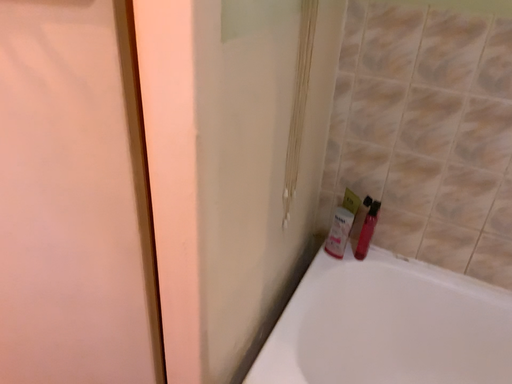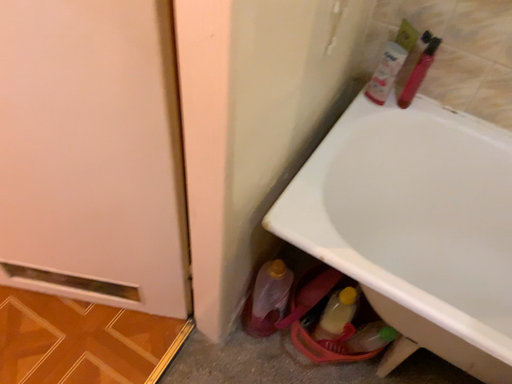
Question: How did the camera likely rotate when shooting the video?

Choices:
 (A) rotated upward
 (B) rotated downward

Answer: (B)